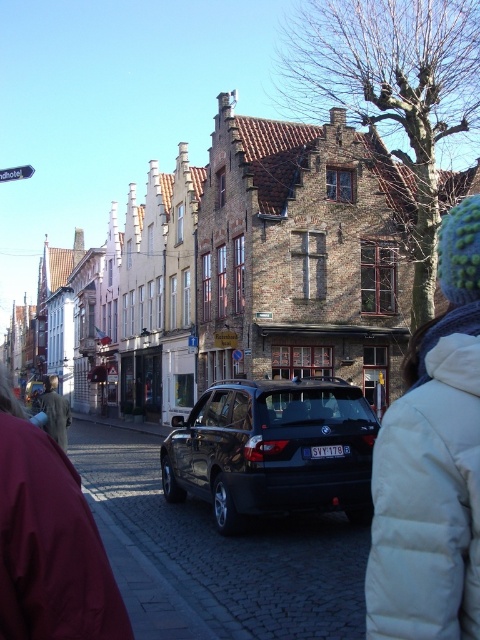
From the picture: Is maroon fabric jacket at lower left bigger than light brown leather jacket at lower left?

No, maroon fabric jacket at lower left is not bigger than light brown leather jacket at lower left.

At what (x,y) coordinates should I click in order to perform the action: click on maroon fabric jacket at lower left. Please return your answer as a coordinate pair (x, y). Image resolution: width=480 pixels, height=640 pixels. Looking at the image, I should click on (48, 541).

Is glossy black car at center wider than maroon fabric jacket at lower left?

In fact, glossy black car at center might be narrower than maroon fabric jacket at lower left.

Between point (207, 470) and point (4, 484), which one is positioned behind?

The point (207, 470) is behind.

Where is `glossy black car at center`? This screenshot has width=480, height=640. glossy black car at center is located at coordinates (273, 449).

What do you see at coordinates (432, 465) in the screenshot? The width and height of the screenshot is (480, 640). I see `white puffy coat at center-right` at bounding box center [432, 465].

Identify the location of white puffy coat at center-right. (432, 465).